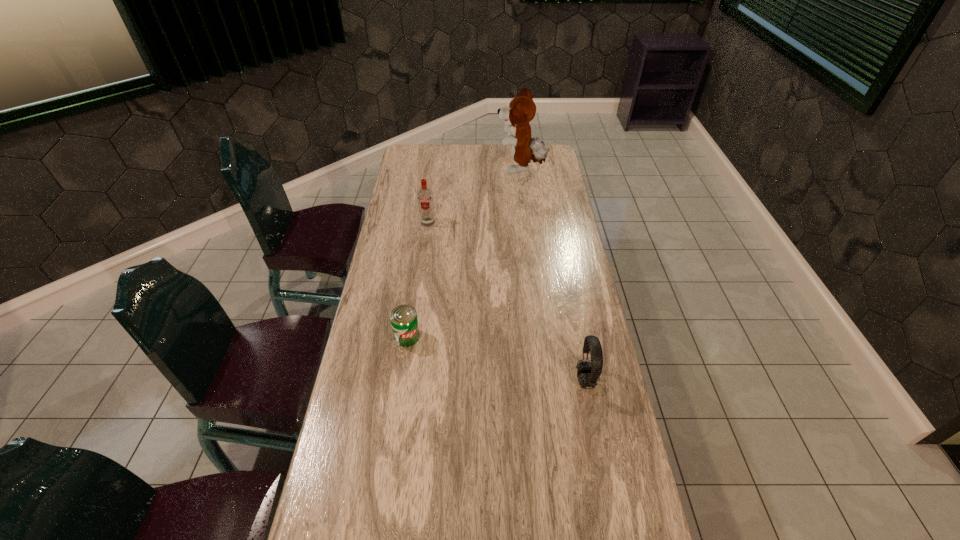
Identify the location of free space between the vodka and the shortest object. This screenshot has height=540, width=960. (418, 279).

This screenshot has height=540, width=960. Find the location of `free space between the shortest object and the headset`. free space between the shortest object and the headset is located at coordinates (496, 359).

Locate an element on the screen. vacant space that's between the second nearest object and the puppy is located at coordinates (464, 253).

You are a GUI agent. You are given a task and a screenshot of the screen. Output one action in this format:
    pyautogui.click(x=<x>, y=<y>)
    Task: Click on the free space between the second nearest object and the farthest object
    The width and height of the screenshot is (960, 540).
    Given the screenshot: What is the action you would take?
    [464, 253]

Locate an element on the screen. vacant area that lies between the vodka and the third tallest object is located at coordinates (507, 301).

Where is `vacant point located between the nearest object and the shortest object`? This screenshot has width=960, height=540. vacant point located between the nearest object and the shortest object is located at coordinates tap(496, 359).

Choose which object is the nearest neighbor to the shortest object. Please provide its 2D coordinates. Your answer should be formatted as a tuple, i.e. [(x, y)], where the tuple contains the x and y coordinates of a point satisfying the conditions above.

[(588, 373)]

This screenshot has height=540, width=960. Identify the location of object that is the third closest to the shortest object. tap(521, 110).

Where is `free location that satisfies the following two spatial constraints: 1. on the face of the puppy; 2. on the front label of the second farthest object`? The height and width of the screenshot is (540, 960). free location that satisfies the following two spatial constraints: 1. on the face of the puppy; 2. on the front label of the second farthest object is located at coordinates (527, 222).

This screenshot has width=960, height=540. I want to click on free spot that satisfies the following two spatial constraints: 1. on the face of the farthest object; 2. on the front label of the second tallest object, so click(x=527, y=222).